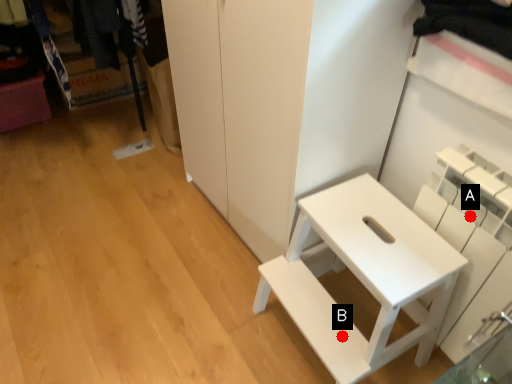
Question: Two points are circled on the image, labeled by A and B beside each circle. Which point is closer to the camera taking this photo?

Choices:
 (A) A is closer
 (B) B is closer

Answer: (A)